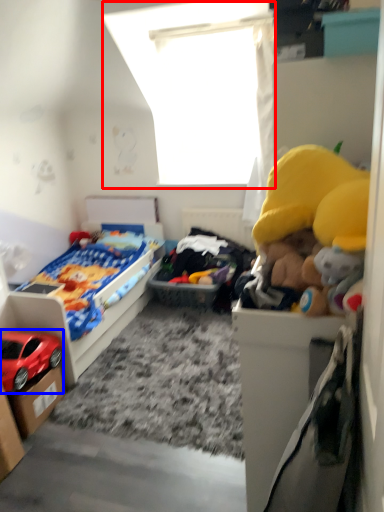
Question: Which point is further to the camera, window screen (highlighted by a red box) or car (highlighted by a blue box)?

Choices:
 (A) window screen
 (B) car

Answer: (A)